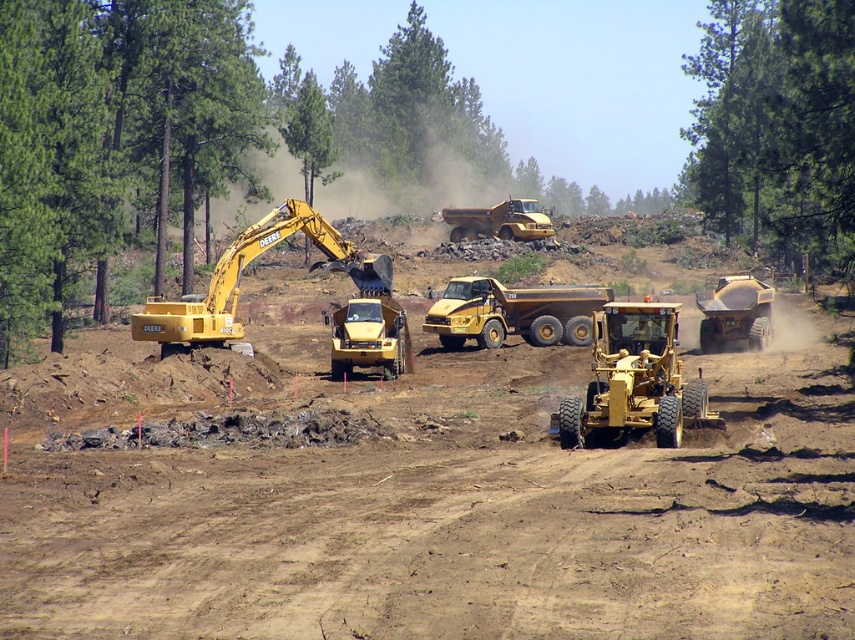
Question: Estimate the real-world distances between objects in this image. Which object is closer to the yellow metallic dump truck at center?

Choices:
 (A) green leafy tree at upper center
 (B) matte yellow tractor at center
 (C) matte yellow tractor at right
 (D) yellow metallic excavator at center-left

Answer: (A)

Question: Among these objects, which one is farthest from the camera?

Choices:
 (A) matte yellow tractor at center
 (B) yellow matte dump truck at center
 (C) matte yellow tractor at right
 (D) yellow metallic excavator at center-left

Answer: (B)

Question: Can you confirm if yellow metallic excavator at center-left is wider than yellow metallic dump truck at center?

Choices:
 (A) yes
 (B) no

Answer: (A)

Question: Which point appears closest to the camera in this image?

Choices:
 (A) (664, 436)
 (B) (463, 298)
 (C) (781, 164)
 (D) (712, 308)

Answer: (A)

Question: Is matte yellow tractor at center to the left of yellow metallic dump truck at center from the viewer's perspective?

Choices:
 (A) no
 (B) yes

Answer: (A)

Question: Can you confirm if green leafy tree at upper center is positioned to the left of yellow metallic excavator at center-left?

Choices:
 (A) no
 (B) yes

Answer: (A)